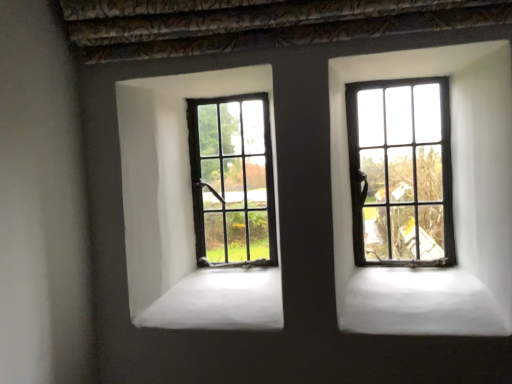
The height and width of the screenshot is (384, 512). What do you see at coordinates (401, 172) in the screenshot?
I see `matte black window at right, positioned as the first window in front-to-back order` at bounding box center [401, 172].

At what (x,y) coordinates should I click in order to perform the action: click on matte black window at right, which is the 2th window in back-to-front order. Please return your answer as a coordinate pair (x, y). This screenshot has height=384, width=512. Looking at the image, I should click on (401, 172).

This screenshot has height=384, width=512. What do you see at coordinates (232, 181) in the screenshot?
I see `matte black window at center, the 2th window from the front` at bounding box center [232, 181].

Find the location of `matte black window at center, the second window positioned from the right`. matte black window at center, the second window positioned from the right is located at coordinates (232, 181).

I want to click on matte black window at right, which ranks as the second window in left-to-right order, so click(401, 172).

Does matte black window at center, the second window positioned from the right, appear on the left side of matte black window at right, which is the 2th window in back-to-front order?

Yes, matte black window at center, the second window positioned from the right, is to the left of matte black window at right, which is the 2th window in back-to-front order.

Which object is closer to the camera, matte black window at center, positioned as the first window in left-to-right order, or matte black window at right, positioned as the first window in right-to-left order?

matte black window at right, positioned as the first window in right-to-left order, is more forward.

Is point (266, 255) farther from viewer compared to point (353, 95)?

That is True.

From the image's perspective, would you say matte black window at center, positioned as the first window in left-to-right order, is shown under matte black window at right, which ranks as the second window in left-to-right order?

Indeed, from the image's perspective, matte black window at center, positioned as the first window in left-to-right order, is shown beneath matte black window at right, which ranks as the second window in left-to-right order.

From a real-world perspective, who is located higher, matte black window at center, positioned as the first window in left-to-right order, or matte black window at right, which is the 2th window in back-to-front order?

matte black window at right, which is the 2th window in back-to-front order, is physically above.

Is matte black window at center, positioned as the first window in left-to-right order, thinner than matte black window at right, positioned as the first window in front-to-back order?

Indeed, matte black window at center, positioned as the first window in left-to-right order, has a lesser width compared to matte black window at right, positioned as the first window in front-to-back order.

From their relative heights in the image, would you say matte black window at center, the second window positioned from the right, is taller or shorter than matte black window at right, positioned as the first window in right-to-left order?

Considering their sizes, matte black window at center, the second window positioned from the right, has less height than matte black window at right, positioned as the first window in right-to-left order.

Considering the sizes of matte black window at center, positioned as the first window in left-to-right order, and matte black window at right, positioned as the first window in right-to-left order, in the image, is matte black window at center, positioned as the first window in left-to-right order, bigger or smaller than matte black window at right, positioned as the first window in right-to-left order,?

matte black window at center, positioned as the first window in left-to-right order, is smaller than matte black window at right, positioned as the first window in right-to-left order.

Is matte black window at center, marked as the 1th window in a back-to-front arrangement, outside of matte black window at right, which ranks as the second window in left-to-right order?

Yes.

Is matte black window at center, the 2th window from the front, beside matte black window at right, positioned as the first window in front-to-back order?

No, matte black window at center, the 2th window from the front, is not with matte black window at right, positioned as the first window in front-to-back order.

Could you tell me if matte black window at center, positioned as the first window in left-to-right order, is turned towards matte black window at right, positioned as the first window in front-to-back order?

No, matte black window at center, positioned as the first window in left-to-right order, is not facing towards matte black window at right, positioned as the first window in front-to-back order.

What's the angular difference between matte black window at center, marked as the 1th window in a back-to-front arrangement, and matte black window at right, positioned as the first window in front-to-back order,'s facing directions?

The angular difference between matte black window at center, marked as the 1th window in a back-to-front arrangement, and matte black window at right, positioned as the first window in front-to-back order, is 0.805 degrees.

Measure the distance between matte black window at center, the second window positioned from the right, and matte black window at right, which ranks as the second window in left-to-right order.

They are 16.35 inches apart.

Where is `window located on the left of matte black window at right, which ranks as the second window in left-to-right order`? The height and width of the screenshot is (384, 512). window located on the left of matte black window at right, which ranks as the second window in left-to-right order is located at coordinates (232, 181).

Consider the image. Would you say matte black window at right, positioned as the first window in right-to-left order, is to the left or to the right of matte black window at center, the 2th window from the front, in the picture?

matte black window at right, positioned as the first window in right-to-left order, is positioned on matte black window at center, the 2th window from the front,'s right side.

Is the position of matte black window at right, which ranks as the second window in left-to-right order, more distant than that of matte black window at center, the 2th window from the front?

No, matte black window at right, which ranks as the second window in left-to-right order, is closer to the viewer.

Which is in front, point (353, 142) or point (209, 241)?

Positioned in front is point (353, 142).

Based on the photo, from the image's perspective, between matte black window at right, which ranks as the second window in left-to-right order, and matte black window at center, marked as the 1th window in a back-to-front arrangement, who is located below?

matte black window at center, marked as the 1th window in a back-to-front arrangement, appears lower in the image.

From a real-world perspective, is matte black window at right, positioned as the first window in front-to-back order, physically located above or below matte black window at center, marked as the 1th window in a back-to-front arrangement?

matte black window at right, positioned as the first window in front-to-back order, is above matte black window at center, marked as the 1th window in a back-to-front arrangement.

Between matte black window at right, positioned as the first window in front-to-back order, and matte black window at center, marked as the 1th window in a back-to-front arrangement, which one has smaller width?

With smaller width is matte black window at center, marked as the 1th window in a back-to-front arrangement.

Considering the sizes of objects matte black window at right, positioned as the first window in front-to-back order, and matte black window at center, positioned as the first window in left-to-right order, in the image provided, who is taller, matte black window at right, positioned as the first window in front-to-back order, or matte black window at center, positioned as the first window in left-to-right order,?

With more height is matte black window at right, positioned as the first window in front-to-back order.

Between matte black window at right, positioned as the first window in right-to-left order, and matte black window at center, the 2th window from the front, which one has smaller size?

matte black window at center, the 2th window from the front, is smaller.

Is matte black window at right, which is the 2th window in back-to-front order, positioned beyond the bounds of matte black window at center, the second window positioned from the right?

Yes, matte black window at right, which is the 2th window in back-to-front order, is located beyond the bounds of matte black window at center, the second window positioned from the right.

Is matte black window at right, which ranks as the second window in left-to-right order, next to matte black window at center, the 2th window from the front?

No, matte black window at right, which ranks as the second window in left-to-right order, is not with matte black window at center, the 2th window from the front.

Does matte black window at right, positioned as the first window in right-to-left order, turn towards matte black window at center, the second window positioned from the right?

No, matte black window at right, positioned as the first window in right-to-left order, is not oriented towards matte black window at center, the second window positioned from the right.

How many degrees apart are the facing directions of matte black window at right, which is the 2th window in back-to-front order, and matte black window at center, positioned as the first window in left-to-right order?

The angular difference between matte black window at right, which is the 2th window in back-to-front order, and matte black window at center, positioned as the first window in left-to-right order, is 0.805 degrees.

How much distance is there between matte black window at right, positioned as the first window in right-to-left order, and matte black window at center, the second window positioned from the right?

matte black window at right, positioned as the first window in right-to-left order, is 41.52 centimeters away from matte black window at center, the second window positioned from the right.

Identify the location of window below the matte black window at right, which ranks as the second window in left-to-right order (from a real-world perspective). (232, 181).

Where is `window that appears below the matte black window at right, which ranks as the second window in left-to-right order (from the image's perspective)`? window that appears below the matte black window at right, which ranks as the second window in left-to-right order (from the image's perspective) is located at coordinates point(232,181).

Identify the location of window lying above the matte black window at center, positioned as the first window in left-to-right order (from the image's perspective). The width and height of the screenshot is (512, 384). (401, 172).